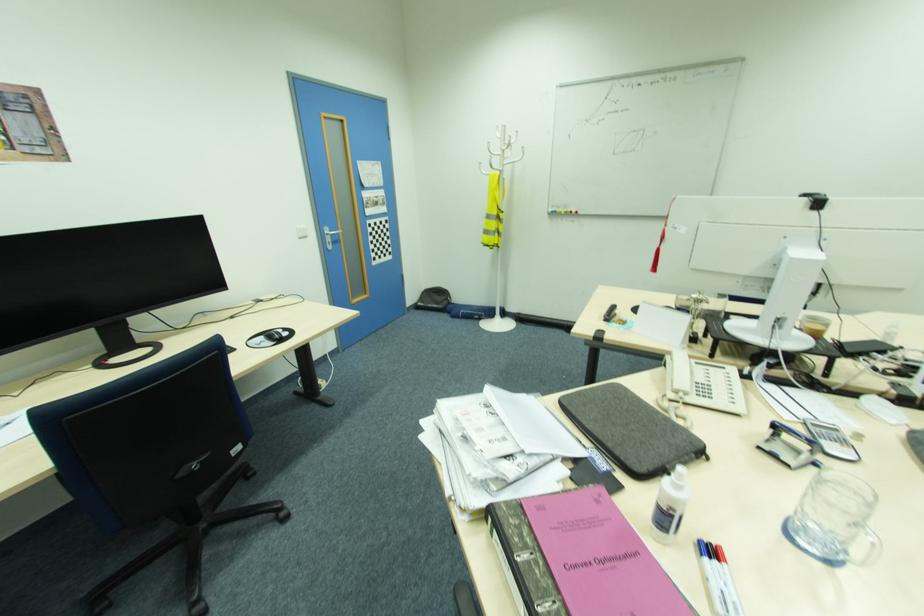
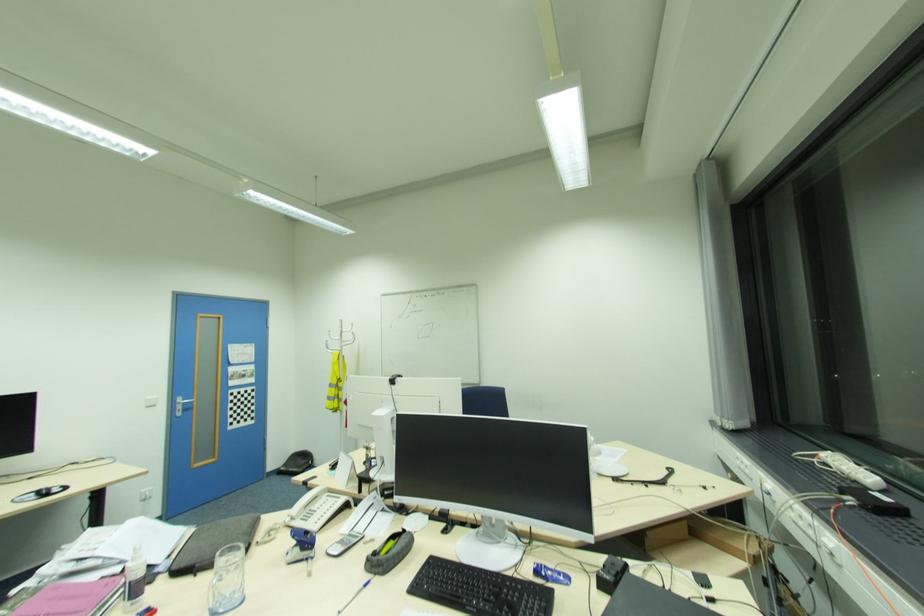
Which direction would the cameraman need to move to produce the second image?

The movement direction of the cameraman is right, backward.